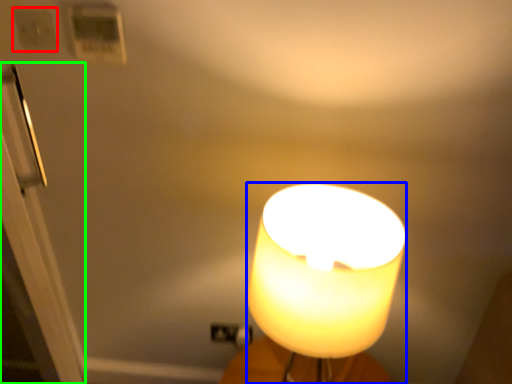
Question: Which object is the closest to the light switch (highlighted by a red box)? Choose among these: lamp (highlighted by a blue box) or door (highlighted by a green box).

Choices:
 (A) lamp
 (B) door

Answer: (B)